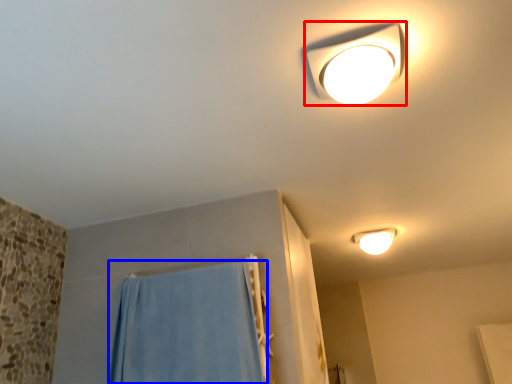
Question: Which object appears farthest to the camera in this image, lamp (highlighted by a red box) or curtain (highlighted by a blue box)?

Choices:
 (A) lamp
 (B) curtain

Answer: (B)